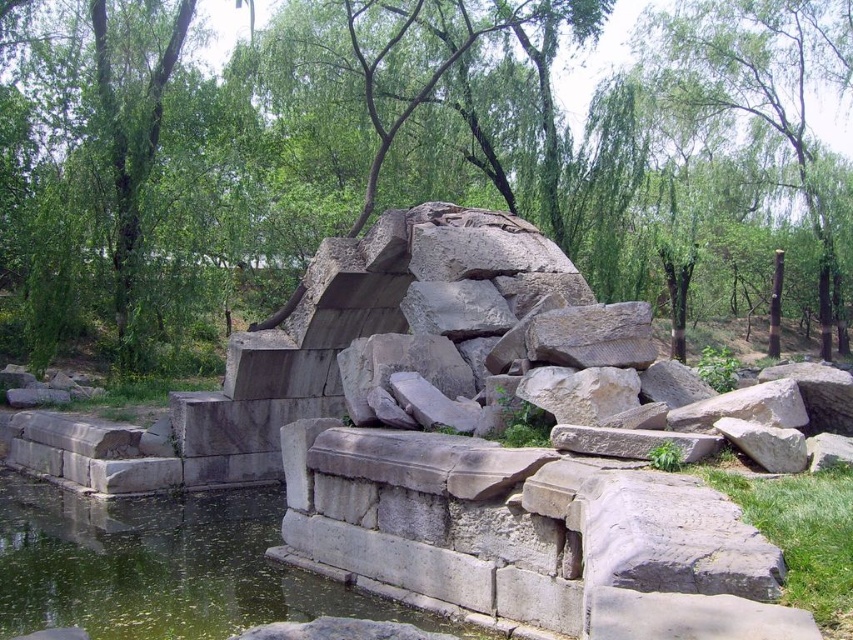
You are a hiker who has just arrived at this serene outdoor scene. You notice a point marked at coordinates (161, 566). What does this point indicate?

The point at coordinates (161, 566) marks greenish murky water at lower left.

You are standing at the edge of the water near the stone structure. You want to walk to the green leafy tree at center. Which direction should you head towards?

The green leafy tree at center is located at point coordinates, so you should head towards the center of the scene to reach it.